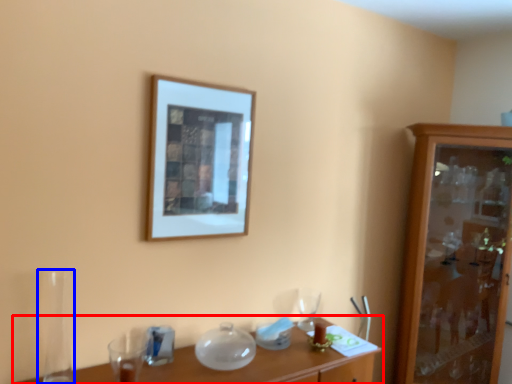
Question: Which of the following is the closest to the observer, table (highlighted by a red box) or glass vase (highlighted by a blue box)?

Choices:
 (A) table
 (B) glass vase

Answer: (A)